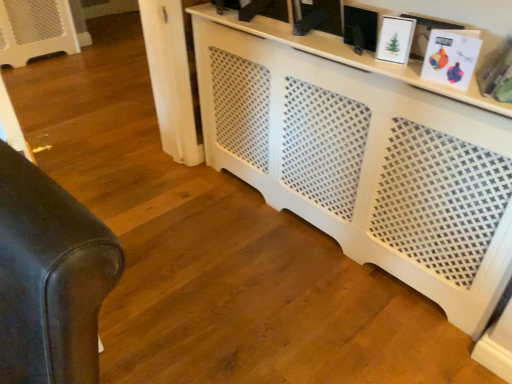
Where is `leather couch at left`? This screenshot has height=384, width=512. leather couch at left is located at coordinates 50,277.

Find the location of `white glossy picture frame at upper right, the 2th picture frame positioned from the right`. white glossy picture frame at upper right, the 2th picture frame positioned from the right is located at coordinates (395, 39).

Describe the element at coordinates (451, 57) in the screenshot. The height and width of the screenshot is (384, 512). I see `white matte picture frame at upper right, placed as the 1th picture frame when sorted from right to left` at that location.

The height and width of the screenshot is (384, 512). What do you see at coordinates (362, 157) in the screenshot?
I see `white perforated cabinet at center` at bounding box center [362, 157].

Image resolution: width=512 pixels, height=384 pixels. What are the coordinates of `matte black picture frame at upper center, which is the 1th picture frame in left-to-right order` in the screenshot? It's located at (360, 28).

Between point (40, 182) and point (402, 20), which one is positioned behind?

The point (402, 20) is behind.

Which is more to the right, leather couch at left or white glossy picture frame at upper right, the 2th picture frame positioned from the right?

From the viewer's perspective, white glossy picture frame at upper right, the 2th picture frame positioned from the right, appears more on the right side.

Measure the distance from leather couch at left to white glossy picture frame at upper right, the second picture frame from the left.

A distance of 1.28 meters exists between leather couch at left and white glossy picture frame at upper right, the second picture frame from the left.

From a real-world perspective, is leather couch at left on white glossy picture frame at upper right, the 2th picture frame positioned from the right?

No, from a real-world perspective, leather couch at left is not above white glossy picture frame at upper right, the 2th picture frame positioned from the right.

Between white matte picture frame at upper right, placed as the 1th picture frame when sorted from right to left, and white glossy picture frame at upper right, the 2th picture frame positioned from the right, which one has smaller size?

With smaller size is white glossy picture frame at upper right, the 2th picture frame positioned from the right.

Is point (461, 88) closer or farther from the camera than point (396, 53)?

Point (461, 88) is closer to the camera than point (396, 53).

Consider the image. Can you confirm if white matte picture frame at upper right, the third picture frame from the left, is taller than white glossy picture frame at upper right, the 2th picture frame positioned from the right?

Correct, white matte picture frame at upper right, the third picture frame from the left, is much taller as white glossy picture frame at upper right, the 2th picture frame positioned from the right.

From the image's perspective, would you say white matte picture frame at upper right, placed as the 1th picture frame when sorted from right to left, is shown under white glossy picture frame at upper right, the 2th picture frame positioned from the right?

Indeed, from the image's perspective, white matte picture frame at upper right, placed as the 1th picture frame when sorted from right to left, is shown beneath white glossy picture frame at upper right, the 2th picture frame positioned from the right.

Is matte black picture frame at upper center, which appears as the third picture frame when viewed from the right, oriented away from white glossy picture frame at upper right, the second picture frame from the left?

That's not correct — matte black picture frame at upper center, which appears as the third picture frame when viewed from the right, is not looking away from white glossy picture frame at upper right, the second picture frame from the left.

Is matte black picture frame at upper center, which is the 1th picture frame in left-to-right order, inside or outside of white glossy picture frame at upper right, the 2th picture frame positioned from the right?

The correct answer is: outside.

Can you confirm if matte black picture frame at upper center, which appears as the third picture frame when viewed from the right, is positioned to the left of white glossy picture frame at upper right, the 2th picture frame positioned from the right?

Indeed, matte black picture frame at upper center, which appears as the third picture frame when viewed from the right, is positioned on the left side of white glossy picture frame at upper right, the 2th picture frame positioned from the right.

How many degrees apart are the facing directions of white matte picture frame at upper right, placed as the 1th picture frame when sorted from right to left, and matte black picture frame at upper center, which appears as the third picture frame when viewed from the right?

2.84 degrees separate the facing orientations of white matte picture frame at upper right, placed as the 1th picture frame when sorted from right to left, and matte black picture frame at upper center, which appears as the third picture frame when viewed from the right.

Relative to matte black picture frame at upper center, which appears as the third picture frame when viewed from the right, is white matte picture frame at upper right, placed as the 1th picture frame when sorted from right to left, in front or behind?

In the image, white matte picture frame at upper right, placed as the 1th picture frame when sorted from right to left, appears in front of matte black picture frame at upper center, which appears as the third picture frame when viewed from the right.

From the image's perspective, is white matte picture frame at upper right, placed as the 1th picture frame when sorted from right to left, on matte black picture frame at upper center, which is the 1th picture frame in left-to-right order?

Incorrect, from the image's perspective, white matte picture frame at upper right, placed as the 1th picture frame when sorted from right to left, is lower than matte black picture frame at upper center, which is the 1th picture frame in left-to-right order.

Does white matte picture frame at upper right, the third picture frame from the left, have a smaller size compared to matte black picture frame at upper center, which is the 1th picture frame in left-to-right order?

Incorrect, white matte picture frame at upper right, the third picture frame from the left, is not smaller in size than matte black picture frame at upper center, which is the 1th picture frame in left-to-right order.

Is white glossy picture frame at upper right, the 2th picture frame positioned from the right, next to leather couch at left?

There is a gap between white glossy picture frame at upper right, the 2th picture frame positioned from the right, and leather couch at left.

Image resolution: width=512 pixels, height=384 pixels. In order to click on furniture on the left of white glossy picture frame at upper right, the second picture frame from the left in this screenshot , I will do `click(50, 277)`.

Considering the relative sizes of white glossy picture frame at upper right, the second picture frame from the left, and leather couch at left in the image provided, is white glossy picture frame at upper right, the second picture frame from the left, wider than leather couch at left?

In fact, white glossy picture frame at upper right, the second picture frame from the left, might be narrower than leather couch at left.

What's the angular difference between white glossy picture frame at upper right, the 2th picture frame positioned from the right, and leather couch at left's facing directions?

The facing directions of white glossy picture frame at upper right, the 2th picture frame positioned from the right, and leather couch at left are 149 degrees apart.

What's the angular difference between matte black picture frame at upper center, which is the 1th picture frame in left-to-right order, and white matte picture frame at upper right, placed as the 1th picture frame when sorted from right to left,'s facing directions?

They differ by 2.84 degrees in their facing directions.

From a real-world perspective, is matte black picture frame at upper center, which appears as the third picture frame when viewed from the right, on top of white matte picture frame at upper right, placed as the 1th picture frame when sorted from right to left?

No, from a real-world perspective, matte black picture frame at upper center, which appears as the third picture frame when viewed from the right, is not on top of white matte picture frame at upper right, placed as the 1th picture frame when sorted from right to left.

From the image's perspective, which one is positioned lower, matte black picture frame at upper center, which appears as the third picture frame when viewed from the right, or white matte picture frame at upper right, placed as the 1th picture frame when sorted from right to left?

white matte picture frame at upper right, placed as the 1th picture frame when sorted from right to left, from the image's perspective.

Considering the positions of points (375, 20) and (466, 54), is point (375, 20) farther from camera compared to point (466, 54)?

Yes, it is behind point (466, 54).

Considering the sizes of objects white perforated cabinet at center and leather couch at left in the image provided, who is thinner, white perforated cabinet at center or leather couch at left?

leather couch at left is thinner.

From a real-world perspective, is white perforated cabinet at center physically above leather couch at left?

No.

Based on the photo, is white perforated cabinet at center next to leather couch at left and touching it?

No, white perforated cabinet at center is not making contact with leather couch at left.

The width and height of the screenshot is (512, 384). Find the location of `furniture below the white glossy picture frame at upper right, the second picture frame from the left (from a real-world perspective)`. furniture below the white glossy picture frame at upper right, the second picture frame from the left (from a real-world perspective) is located at coordinates (50, 277).

The image size is (512, 384). In the image, there is a white glossy picture frame at upper right, the second picture frame from the left. In order to click on picture frame below it (from the image's perspective) in this screenshot , I will do `click(451, 57)`.

Which object lies further to the anchor point white perforated cabinet at center, leather couch at left or matte black picture frame at upper center, which is the 1th picture frame in left-to-right order?

Among the two, leather couch at left is located further to white perforated cabinet at center.

From the image, which object appears to be nearer to white matte picture frame at upper right, placed as the 1th picture frame when sorted from right to left, matte black picture frame at upper center, which appears as the third picture frame when viewed from the right, or leather couch at left?

matte black picture frame at upper center, which appears as the third picture frame when viewed from the right, is positioned closer to the anchor white matte picture frame at upper right, placed as the 1th picture frame when sorted from right to left.

From the picture: Looking at the image, which one is located closer to white glossy picture frame at upper right, the second picture frame from the left, white perforated cabinet at center or leather couch at left?

Based on the image, white perforated cabinet at center appears to be nearer to white glossy picture frame at upper right, the second picture frame from the left.

Estimate the real-world distances between objects in this image. Which object is closer to white glossy picture frame at upper right, the second picture frame from the left, matte black picture frame at upper center, which is the 1th picture frame in left-to-right order, or white matte picture frame at upper right, placed as the 1th picture frame when sorted from right to left?

The object closer to white glossy picture frame at upper right, the second picture frame from the left, is matte black picture frame at upper center, which is the 1th picture frame in left-to-right order.

Estimate the real-world distances between objects in this image. Which object is further from white glossy picture frame at upper right, the 2th picture frame positioned from the right, white matte picture frame at upper right, placed as the 1th picture frame when sorted from right to left, or matte black picture frame at upper center, which appears as the third picture frame when viewed from the right?

white matte picture frame at upper right, placed as the 1th picture frame when sorted from right to left, lies further to white glossy picture frame at upper right, the 2th picture frame positioned from the right, than the other object.

Based on their spatial positions, is matte black picture frame at upper center, which appears as the third picture frame when viewed from the right, or white perforated cabinet at center closer to white matte picture frame at upper right, the third picture frame from the left?

matte black picture frame at upper center, which appears as the third picture frame when viewed from the right.

From the image, which object appears to be nearer to matte black picture frame at upper center, which appears as the third picture frame when viewed from the right, white matte picture frame at upper right, placed as the 1th picture frame when sorted from right to left, or white glossy picture frame at upper right, the 2th picture frame positioned from the right?

white glossy picture frame at upper right, the 2th picture frame positioned from the right, is closer to matte black picture frame at upper center, which appears as the third picture frame when viewed from the right.

From the image, which object appears to be nearer to matte black picture frame at upper center, which appears as the third picture frame when viewed from the right, leather couch at left or white glossy picture frame at upper right, the second picture frame from the left?

white glossy picture frame at upper right, the second picture frame from the left, is closer to matte black picture frame at upper center, which appears as the third picture frame when viewed from the right.

Locate an element on the screen. The image size is (512, 384). entertainment center located between leather couch at left and white glossy picture frame at upper right, the second picture frame from the left, in the left-right direction is located at coordinates (362, 157).

Locate an element on the screen. This screenshot has height=384, width=512. picture frame between white glossy picture frame at upper right, the 2th picture frame positioned from the right, and white perforated cabinet at center, in the vertical direction is located at coordinates (451, 57).

I want to click on picture frame located between leather couch at left and white glossy picture frame at upper right, the second picture frame from the left, in the left-right direction, so click(x=360, y=28).

Identify the location of entertainment center situated between leather couch at left and white matte picture frame at upper right, the third picture frame from the left, from left to right. (362, 157).